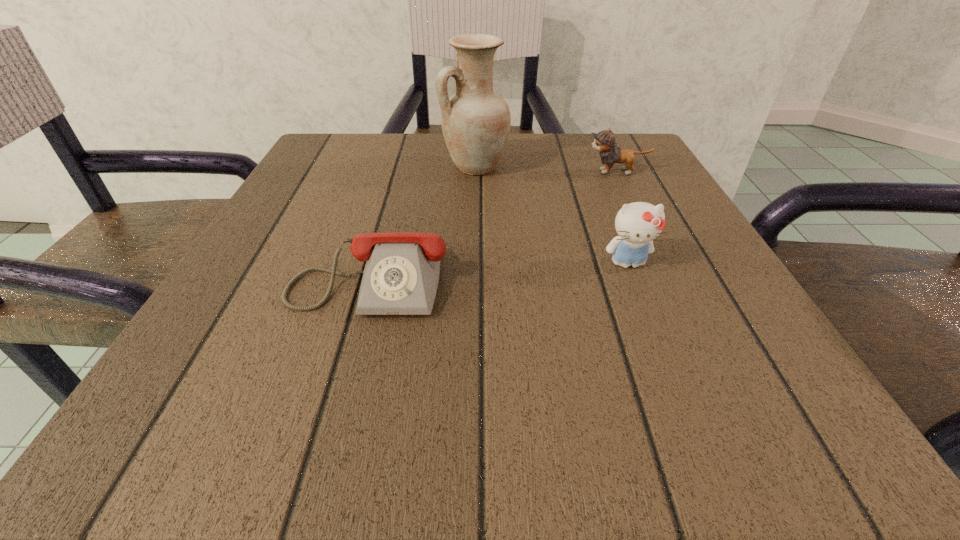
The height and width of the screenshot is (540, 960). I want to click on vacant space at the near left corner, so click(140, 416).

Locate an element on the screen. The height and width of the screenshot is (540, 960). blank region between the telephone and the pottery is located at coordinates (423, 220).

Where is `empty space between the farther kitten and the shortest object`? The image size is (960, 540). empty space between the farther kitten and the shortest object is located at coordinates (x=494, y=222).

Where is `unoccupied position between the second tallest object and the pottery`? The image size is (960, 540). unoccupied position between the second tallest object and the pottery is located at coordinates click(x=551, y=215).

Locate an element on the screen. This screenshot has height=540, width=960. free space that is in between the tallest object and the shortest object is located at coordinates (423, 220).

Identify the location of free space that is in between the pottery and the second shortest object. (546, 170).

The height and width of the screenshot is (540, 960). Find the location of `unoccupied area between the farther kitten and the telephone`. unoccupied area between the farther kitten and the telephone is located at coordinates (494, 222).

What are the coordinates of `free space that is in between the taller kitten and the shortest object` in the screenshot? It's located at (499, 268).

Identify the location of vacant point located between the third tallest object and the pottery. (546, 170).

The width and height of the screenshot is (960, 540). In order to click on free space between the shorter kitten and the shortest object in this screenshot , I will do `click(494, 222)`.